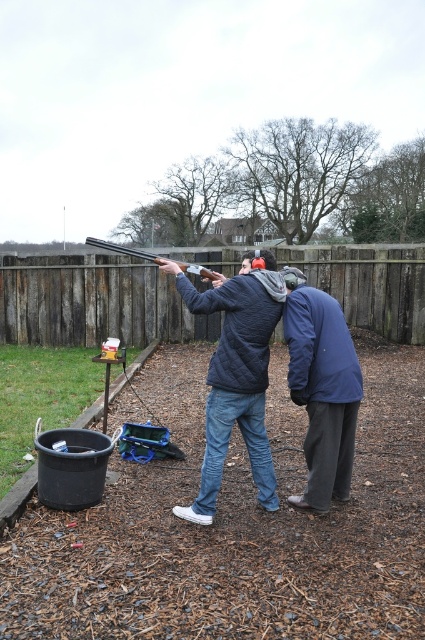
Which is above, brown wooden fence at upper center or dark blue fabric jacket at center?

brown wooden fence at upper center

Is point (42, 332) more distant than point (294, 296)?

Yes, point (42, 332) is behind point (294, 296).

Where is `brown wooden fence at upper center`? This screenshot has height=640, width=425. brown wooden fence at upper center is located at coordinates (91, 301).

Does dark blue fabric jacket at center have a lesser width compared to matte black shotgun at center?

Indeed, dark blue fabric jacket at center has a lesser width compared to matte black shotgun at center.

Between dark blue fabric jacket at center and matte black shotgun at center, which one appears on the right side from the viewer's perspective?

From the viewer's perspective, dark blue fabric jacket at center appears more on the right side.

Find the location of a particular element. The height and width of the screenshot is (640, 425). dark blue fabric jacket at center is located at coordinates 322,388.

Is point (210, 449) positioned after point (96, 241)?

No.

Does point (246, 294) lie in front of point (183, 269)?

Yes.

You are a GUI agent. You are given a task and a screenshot of the screen. Output one action in this format:
    pyautogui.click(x=<x>, y=<y>)
    Task: Click on the dark blue quilted jacket at center
    This screenshot has height=640, width=425.
    Given the screenshot: What is the action you would take?
    pyautogui.click(x=235, y=374)